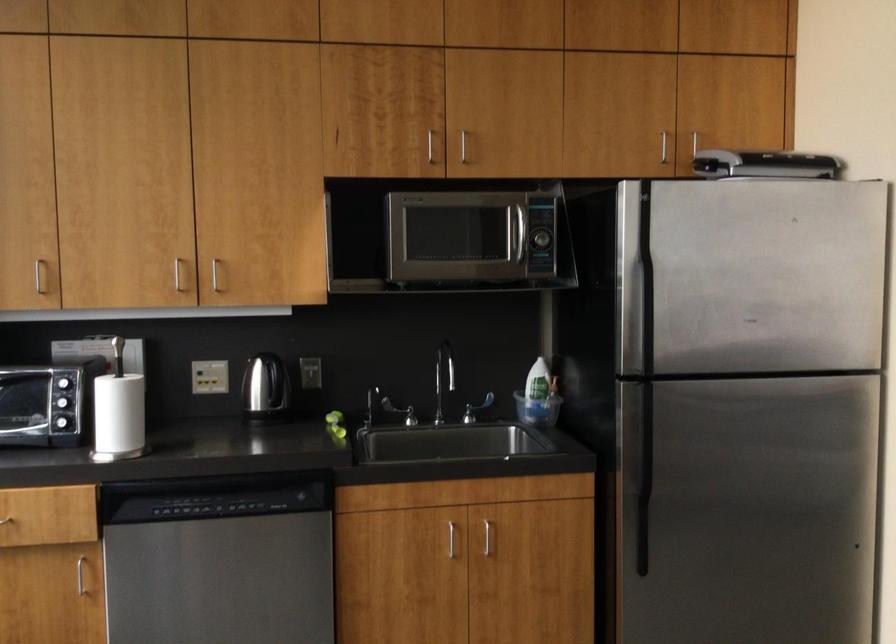
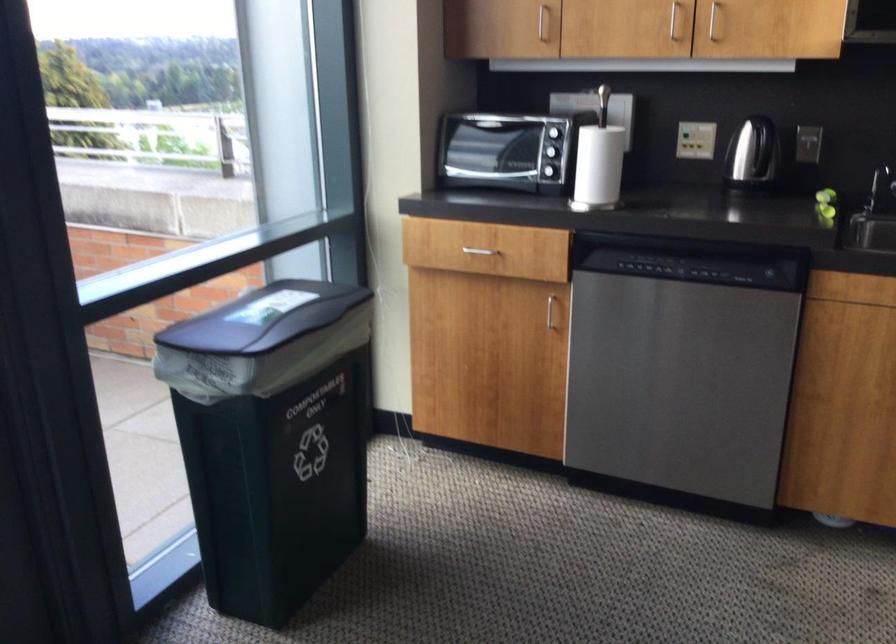
Where in the second image is the point corresponding to point (188, 277) from the first image?

(673, 20)